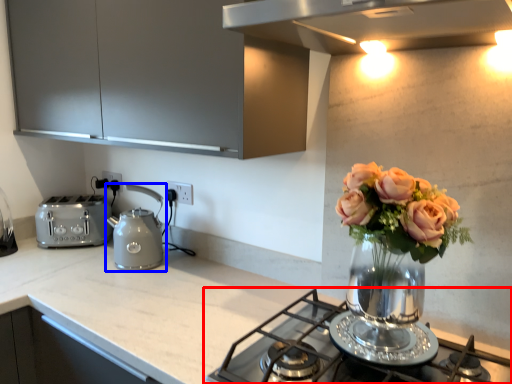
Question: Which object appears closest to the camera in this image, gas stove (highlighted by a red box) or kettle (highlighted by a blue box)?

Choices:
 (A) gas stove
 (B) kettle

Answer: (A)